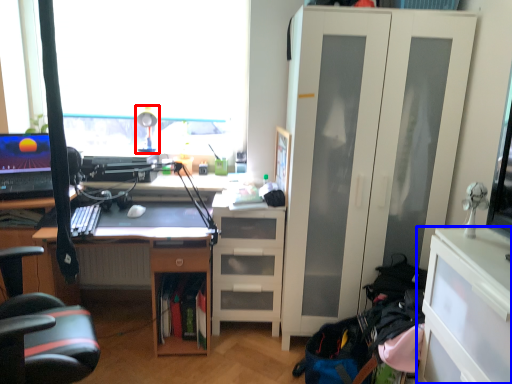
Question: Which point is further to the camera, table lamp (highlighted by a red box) or cabinetry (highlighted by a blue box)?

Choices:
 (A) table lamp
 (B) cabinetry

Answer: (A)